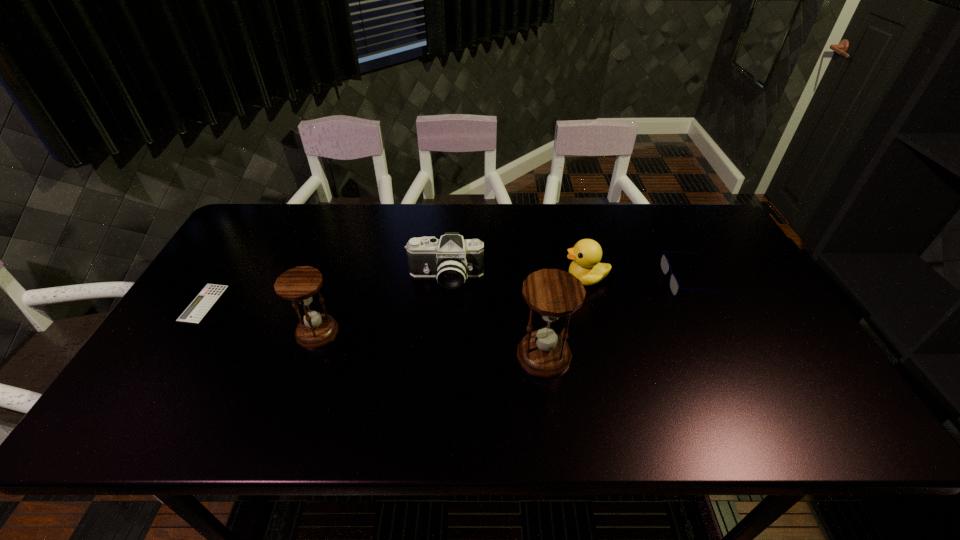
The width and height of the screenshot is (960, 540). Find the location of `object that is at the near edge`. object that is at the near edge is located at coordinates (552, 293).

Where is `object located at the left edge`? Image resolution: width=960 pixels, height=540 pixels. object located at the left edge is located at coordinates (199, 307).

This screenshot has width=960, height=540. I want to click on object at the right edge, so [674, 285].

In the image, there is a desktop. Where is `vacant region at the far edge`? This screenshot has height=540, width=960. vacant region at the far edge is located at coordinates (668, 231).

Identify the location of free space at the near edge of the desktop. The width and height of the screenshot is (960, 540). (640, 373).

Locate an element on the screen. The image size is (960, 540). free space at the left edge of the desktop is located at coordinates (227, 249).

What are the coordinates of `vacant region at the right edge of the desktop` in the screenshot? It's located at (762, 340).

In the image, there is a desktop. Find the location of `free space at the near left corner`. free space at the near left corner is located at coordinates (210, 370).

Locate an element on the screen. free space at the near right corner of the desktop is located at coordinates (780, 375).

The image size is (960, 540). Find the location of `free space between the fourth object from right to left and the second object from left to right`. free space between the fourth object from right to left and the second object from left to right is located at coordinates (382, 305).